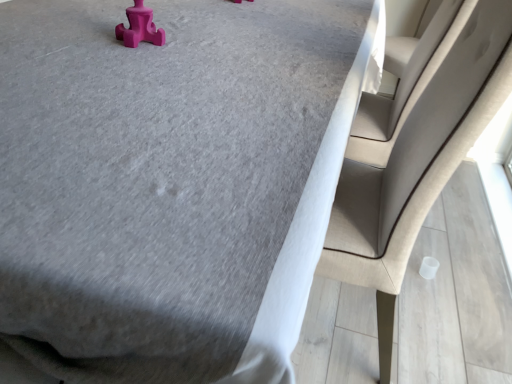
This screenshot has height=384, width=512. In order to click on vacant space behind pink rubber toy at upper left in this screenshot , I will do point(163,23).